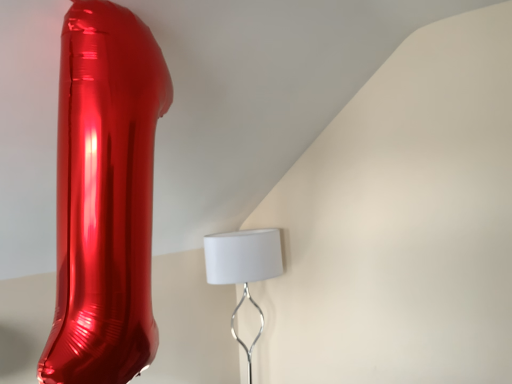
The image size is (512, 384). I want to click on shiny metallic balloon at left, so click(x=105, y=196).

Measure the distance between point (148, 218) and camera.

Point (148, 218) and camera are 37.40 inches apart.

Image resolution: width=512 pixels, height=384 pixels. Describe the element at coordinates (105, 196) in the screenshot. I see `shiny metallic balloon at left` at that location.

What do you see at coordinates (244, 267) in the screenshot? I see `white matte lampshade at center` at bounding box center [244, 267].

I want to click on white matte lampshade at center, so click(x=244, y=267).

Identify the location of shiny metallic balloon at left. The height and width of the screenshot is (384, 512). (105, 196).

Considering the relative positions of shiny metallic balloon at left and white matte lampshade at center in the image provided, is shiny metallic balloon at left to the left of white matte lampshade at center from the viewer's perspective?

Correct, you'll find shiny metallic balloon at left to the left of white matte lampshade at center.

Is shiny metallic balloon at left behind white matte lampshade at center?

No, shiny metallic balloon at left is in front of white matte lampshade at center.

Which point is more distant from viewer, (151, 168) or (262, 312)?

The point (262, 312) is farther from the camera.

From the image's perspective, is shiny metallic balloon at left located above or below white matte lampshade at center?

shiny metallic balloon at left is above white matte lampshade at center.

From a real-world perspective, is shiny metallic balloon at left located higher than white matte lampshade at center?

Indeed, from a real-world perspective, shiny metallic balloon at left stands above white matte lampshade at center.

Does shiny metallic balloon at left have a lesser width compared to white matte lampshade at center?

Yes.

Considering the sizes of objects shiny metallic balloon at left and white matte lampshade at center in the image provided, who is taller, shiny metallic balloon at left or white matte lampshade at center?

Standing taller between the two is shiny metallic balloon at left.

Is shiny metallic balloon at left bigger than white matte lampshade at center?

Indeed, shiny metallic balloon at left has a larger size compared to white matte lampshade at center.

Do you think shiny metallic balloon at left is within white matte lampshade at center, or outside of it?

shiny metallic balloon at left cannot be found inside white matte lampshade at center.

Is shiny metallic balloon at left touching white matte lampshade at center?

No, shiny metallic balloon at left is not in contact with white matte lampshade at center.

Is shiny metallic balloon at left facing away from white matte lampshade at center?

shiny metallic balloon at left is not turned away from white matte lampshade at center.

This screenshot has width=512, height=384. I want to click on lamp lying behind the shiny metallic balloon at left, so click(x=244, y=267).

Which is more to the right, white matte lampshade at center or shiny metallic balloon at left?

Positioned to the right is white matte lampshade at center.

Does white matte lampshade at center come in front of shiny metallic balloon at left?

No, it is behind shiny metallic balloon at left.

Is point (268, 257) behind point (152, 177)?

Yes, it is.

From the image's perspective, relative to shiny metallic balloon at left, is white matte lampshade at center above or below?

Based on their image positions, white matte lampshade at center is located beneath shiny metallic balloon at left.

From a real-world perspective, between white matte lampshade at center and shiny metallic balloon at left, who is vertically lower?

white matte lampshade at center.

Looking at their sizes, would you say white matte lampshade at center is wider or thinner than shiny metallic balloon at left?

Clearly, white matte lampshade at center has more width compared to shiny metallic balloon at left.

Can you confirm if white matte lampshade at center is taller than shiny metallic balloon at left?

In fact, white matte lampshade at center may be shorter than shiny metallic balloon at left.

Can you confirm if white matte lampshade at center is smaller than shiny metallic balloon at left?

Indeed, white matte lampshade at center has a smaller size compared to shiny metallic balloon at left.

Is white matte lampshade at center completely or partially outside of shiny metallic balloon at left?

Absolutely, white matte lampshade at center is external to shiny metallic balloon at left.

Is white matte lampshade at center with shiny metallic balloon at left?

There is a gap between white matte lampshade at center and shiny metallic balloon at left.

Could you tell me if white matte lampshade at center is facing shiny metallic balloon at left?

No, white matte lampshade at center is not oriented towards shiny metallic balloon at left.

How distant is white matte lampshade at center from shiny metallic balloon at left?

3.65 feet.

Locate an element on the screen. glass vase that appears on the left of white matte lampshade at center is located at coordinates (105, 196).

Find the location of a particular element. The width and height of the screenshot is (512, 384). lamp behind the shiny metallic balloon at left is located at coordinates (244, 267).

Locate an element on the screen. lamp below the shiny metallic balloon at left (from a real-world perspective) is located at coordinates (244, 267).